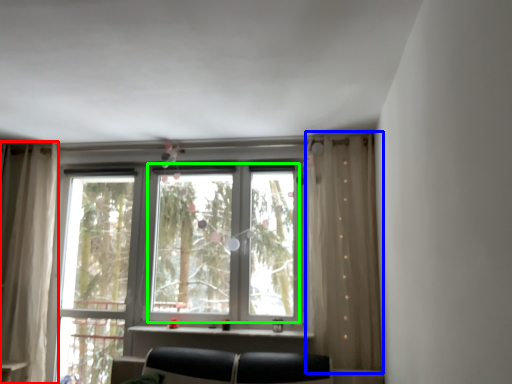
Question: Considering the real-world distances, which object is closest to curtain (highlighted by a red box)? curtain (highlighted by a blue box) or bay window (highlighted by a green box).

Choices:
 (A) curtain
 (B) bay window

Answer: (B)